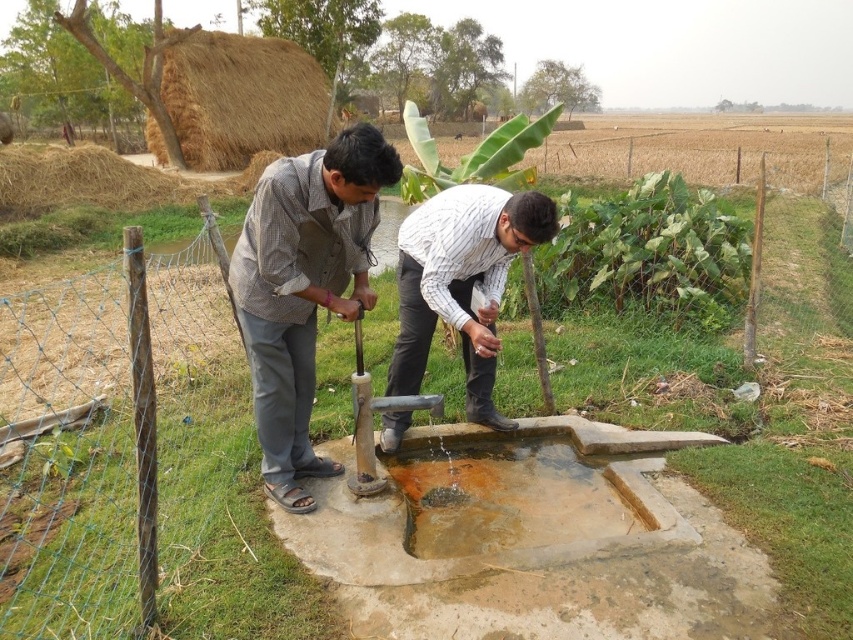
Is point (469, 518) less distant than point (412, 228)?

Yes, it is.

Does brown concrete puddle at center have a lesser height compared to white striped shirt at center?

Yes.

Does point (509, 488) come farther from viewer compared to point (403, 381)?

No, (509, 488) is closer to viewer.

Locate an element on the screen. The image size is (853, 640). brown concrete puddle at center is located at coordinates (505, 493).

Does matte gray shirt at center appear on the right side of white striped shirt at center?

Incorrect, matte gray shirt at center is not on the right side of white striped shirt at center.

Can you confirm if matte gray shirt at center is wider than white striped shirt at center?

Indeed, matte gray shirt at center has a greater width compared to white striped shirt at center.

At what (x,y) coordinates should I click in order to perform the action: click on matte gray shirt at center. Please return your answer as a coordinate pair (x, y). Image resolution: width=853 pixels, height=640 pixels. Looking at the image, I should click on click(305, 288).

Does matte gray shirt at center appear on the left side of brown concrete puddle at center?

Correct, you'll find matte gray shirt at center to the left of brown concrete puddle at center.

Is point (341, 291) positioned in front of point (451, 508)?

Yes, point (341, 291) is closer to viewer.

Measure the distance between point (368, 173) and camera.

Point (368, 173) and camera are 2.64 meters apart.

This screenshot has height=640, width=853. What are the coordinates of `matte gray shirt at center` in the screenshot? It's located at (305, 288).